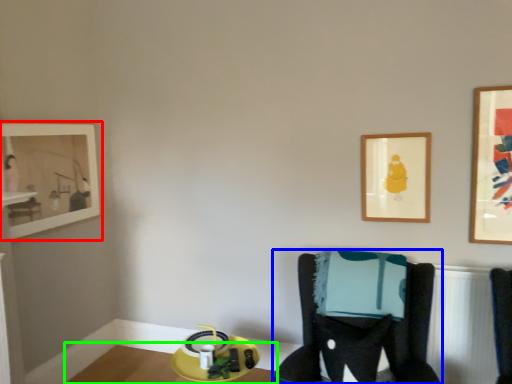
Question: Considering the real-world distances, which object is farthest from picture frame (highlighted by a red box)? furniture (highlighted by a blue box) or table (highlighted by a green box)?

Choices:
 (A) furniture
 (B) table

Answer: (A)